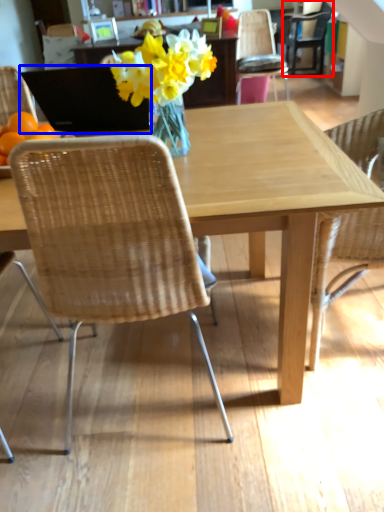
Question: Among these objects, which one is farthest to the camera, chair (highlighted by a red box) or laptop (highlighted by a blue box)?

Choices:
 (A) chair
 (B) laptop

Answer: (A)